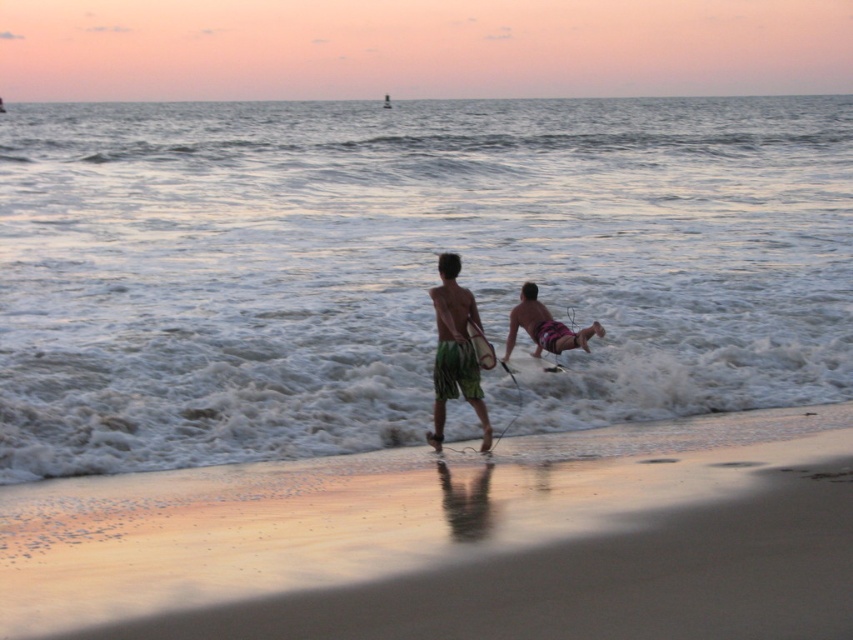
You are a photographer on the beach trying to capture both the pink fabric surfboard at center and the smooth brown surfboard at center in the same frame. Which surfboard should you focus on first to ensure both are in the shot?

The pink fabric surfboard at center is located above the smooth brown surfboard at center, so you should focus on the smooth brown surfboard at center first to ensure both are in the shot.

You are planning to pack your bag for a beach trip and have both the green textured shorts at center and the smooth brown surfboard at center. If you want to carry both items in a backpack with limited space, which item should you prioritize packing first based on their sizes?

The green textured shorts at center has a larger size compared to the smooth brown surfboard at center, so you should prioritize packing the green textured shorts at center first to ensure both items fit in the backpack.